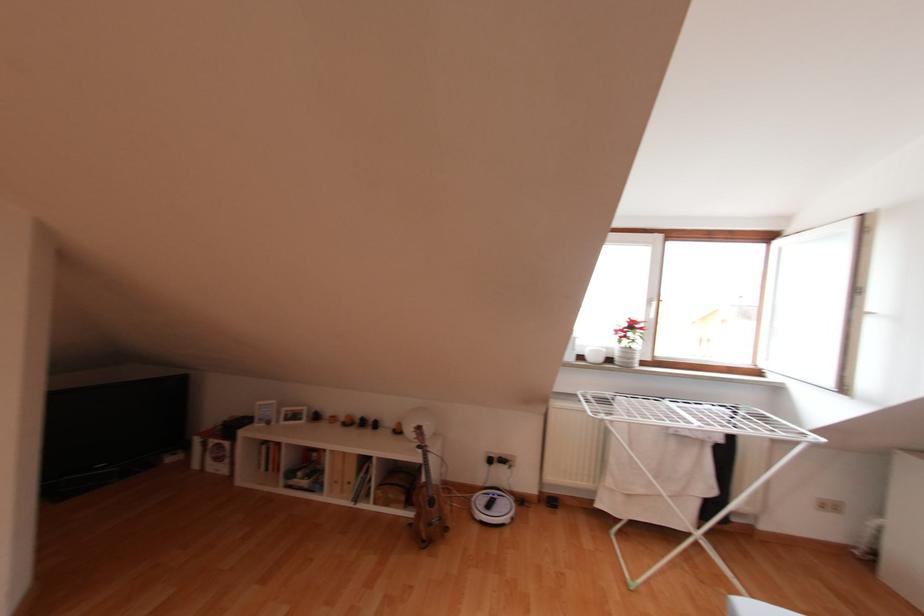
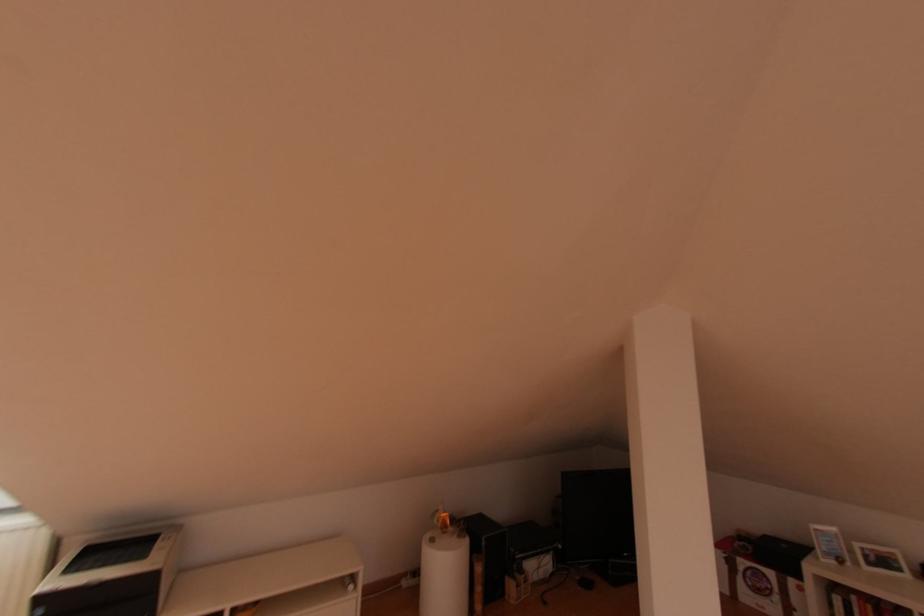
In the second image, find the point that corresponds to (x=268, y=423) in the first image.

(840, 562)